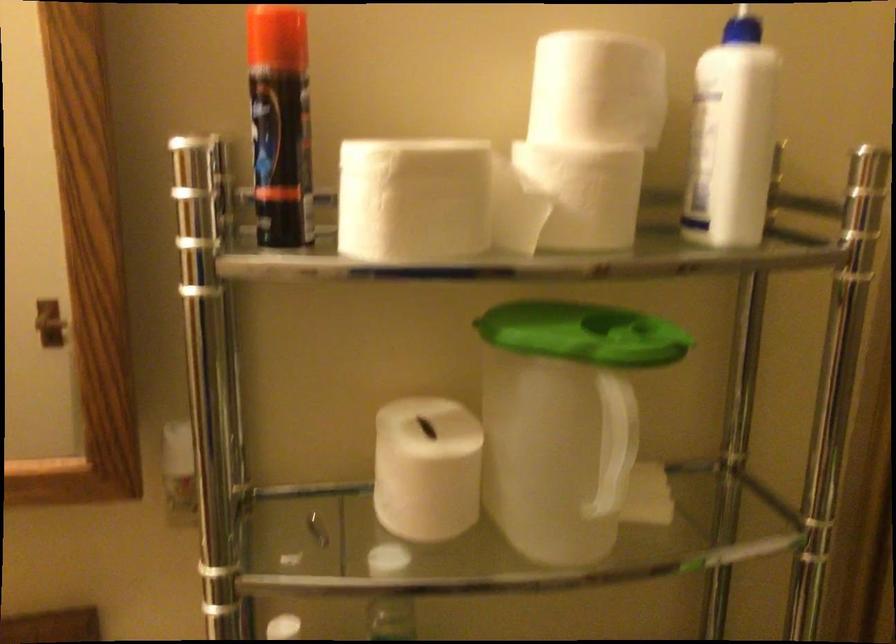
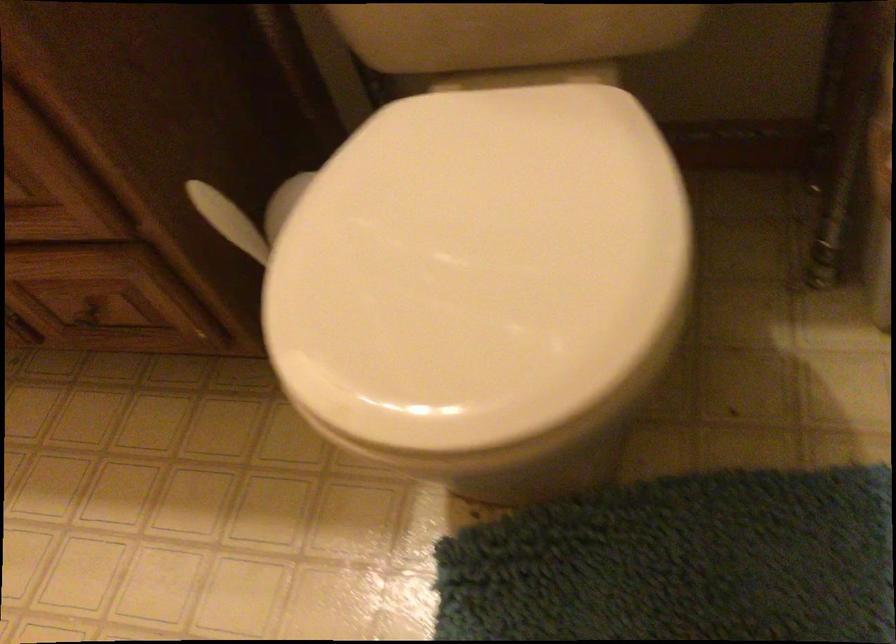
Based on the photo, how did the camera likely rotate?

The rotation direction of the camera is left-down.